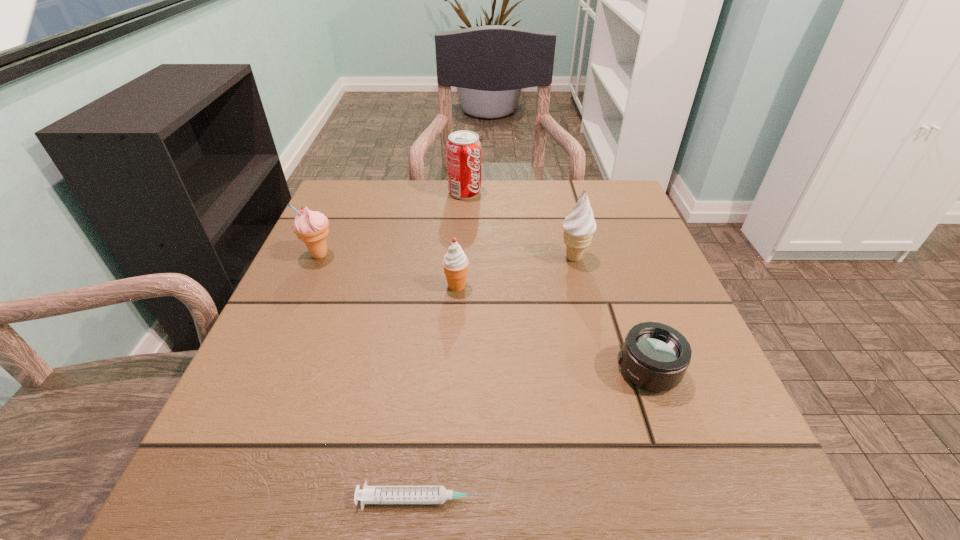
Find the location of a particular element. The height and width of the screenshot is (540, 960). empty space between the farthest object and the tallest icecream is located at coordinates (519, 225).

The width and height of the screenshot is (960, 540). In order to click on blank region between the leftmost object and the nearest icecream in this screenshot , I will do `click(388, 271)`.

Locate an element on the screen. empty space between the second icecream from right to left and the fifth farthest object is located at coordinates (552, 328).

Locate an element on the screen. The width and height of the screenshot is (960, 540). unoccupied position between the rightmost icecream and the nearest object is located at coordinates (498, 379).

Find the location of `empty space between the rightmost icecream and the telephoto lens`. empty space between the rightmost icecream and the telephoto lens is located at coordinates (611, 314).

Where is `blank region between the nearest icecream and the tallest icecream`? blank region between the nearest icecream and the tallest icecream is located at coordinates (516, 272).

The height and width of the screenshot is (540, 960). What are the coordinates of `vacant space in between the nearest icecream and the tallest icecream` in the screenshot? It's located at (516, 272).

Identify the location of free space between the leftmost icecream and the soda can. (393, 224).

What are the coordinates of `free space that is in between the second nearest object and the rightmost icecream` in the screenshot? It's located at (611, 314).

Identify the location of object identified as the fifth closest to the fifth farthest object. This screenshot has height=540, width=960. (311, 227).